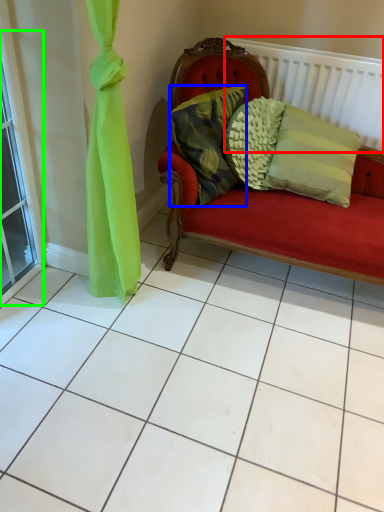
Question: Which is farther away from balustrade (highlighted by a red box)? pillow (highlighted by a blue box) or window (highlighted by a green box)?

Choices:
 (A) pillow
 (B) window

Answer: (B)